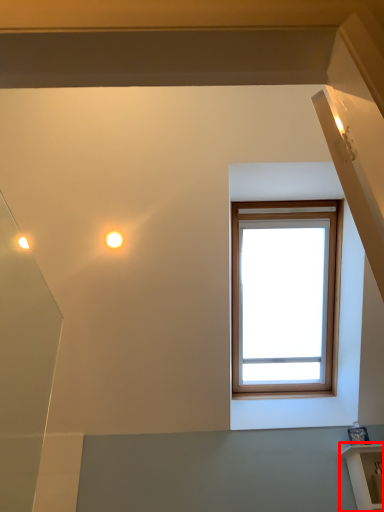
Question: Observing the image, what is the correct spatial positioning of shelf (annotated by the red box) in reference to droplight?

Choices:
 (A) right
 (B) left

Answer: (A)